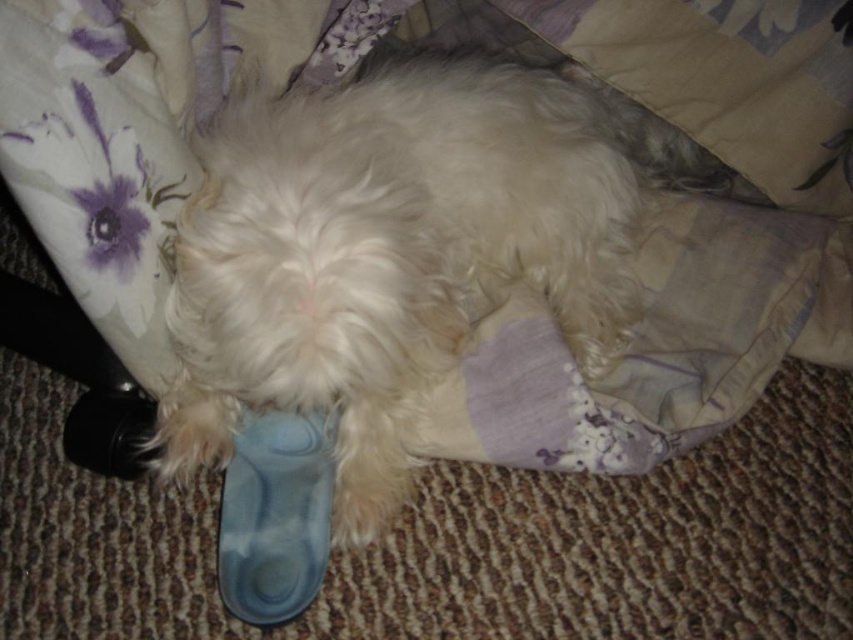
You are an interior designer assessing the layout of a bedroom. The white fluffy dog at center is positioned at coordinates 0.388, 0.469. If you want to place a new decorative item in the bedroom, where should you avoid placing it to ensure it doesn t disturb the dog?

You should avoid placing the decorative item near the white fluffy dog at center, which is located at coordinates (399, 248), to prevent disturbing it.

Looking at this image, you are a pet sitter who needs to retrieve the blue rubber shoe at lower center from where the white fluffy dog at center is lying. Can you reach the shoe without moving the dog?

The white fluffy dog at center is to the right of the blue rubber shoe at lower center, so you can reach the blue rubber shoe at lower center by moving left from the dog without needing to move it.